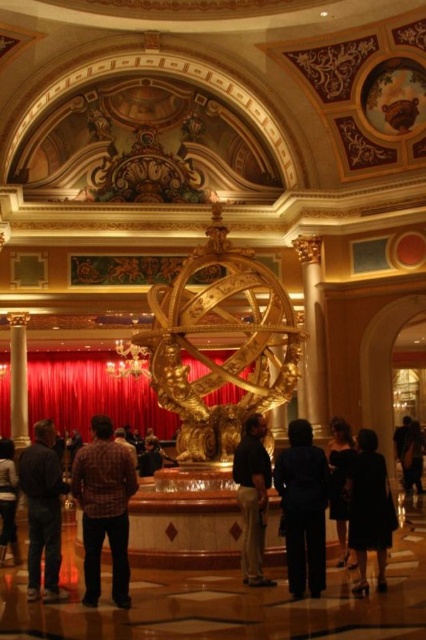
You are a photographer planning to capture the gold polished sphere at center and the black silk dress at center in the same frame. Based on their sizes, which object should you focus on first to ensure both are in sharp focus?

The gold polished sphere at center is larger than the black silk dress at center, so you should focus on the gold polished sphere at center first to ensure both are in sharp focus.

You are a stage designer preparing for a performance. You need to decide which item has a greater width between the red velvet curtain at center and the dark gray pants at lower left. Which one is wider?

The red velvet curtain at center is wider than the dark gray pants at lower left according to the description.

You are a guest at this grand hotel and you want to take a photo of the golden sculpture. You are standing at the entrance, which is located at the bottom left corner of the room. Where should you position yourself to ensure the golden sculpture is in the center of your photo while avoiding the black silk dress at center?

To center the golden sculpture in your photo while avoiding the black silk dress at center, position yourself slightly to the left of the entrance at the bottom left corner. Since the black silk dress at center is located at point (339, 488), moving left will place the sculpture centrally while keeping the dress out of frame.